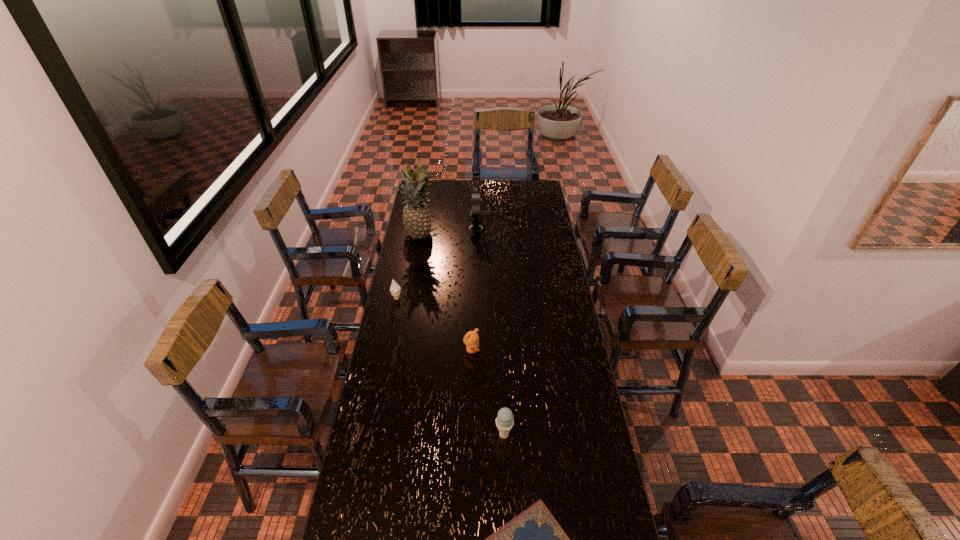
This screenshot has width=960, height=540. I want to click on the tallest object, so click(416, 219).

Where is `the fifth shortest object`? This screenshot has width=960, height=540. the fifth shortest object is located at coordinates (476, 216).

The width and height of the screenshot is (960, 540). What are the coordinates of `the taller icecream` in the screenshot? It's located at (504, 421).

The height and width of the screenshot is (540, 960). What are the coordinates of `the third tallest object` in the screenshot? It's located at point(504,421).

The width and height of the screenshot is (960, 540). Find the location of `the third farthest object`. the third farthest object is located at coordinates click(395, 289).

Find the location of a particular element. the left icecream is located at coordinates (395, 289).

Locate an element on the screen. teddy bear is located at coordinates (471, 339).

Where is `vacant space positioned 0.400m on the front of the tallest object`? The image size is (960, 540). vacant space positioned 0.400m on the front of the tallest object is located at coordinates (409, 298).

Identify the location of free space located 0.100m on the ear cups of the second tallest object. This screenshot has width=960, height=540. (502, 229).

You are a GUI agent. You are given a task and a screenshot of the screen. Output one action in this format:
    pyautogui.click(x=<x>, y=<y>)
    Task: Click on the vacant space located on the left of the right icecream
    
    Given the screenshot: What is the action you would take?
    pyautogui.click(x=412, y=435)